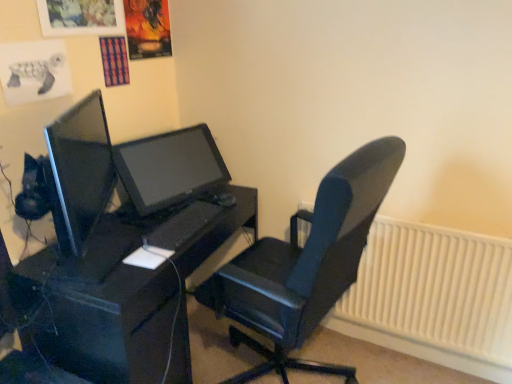
Locate an element on the screen. free space to the left of white plastic radiator at lower right is located at coordinates (306, 353).